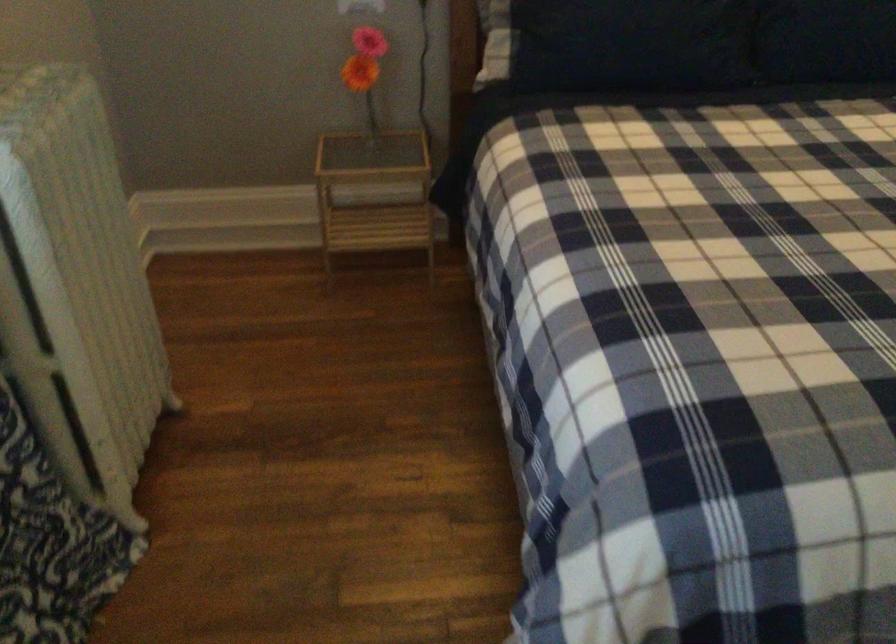
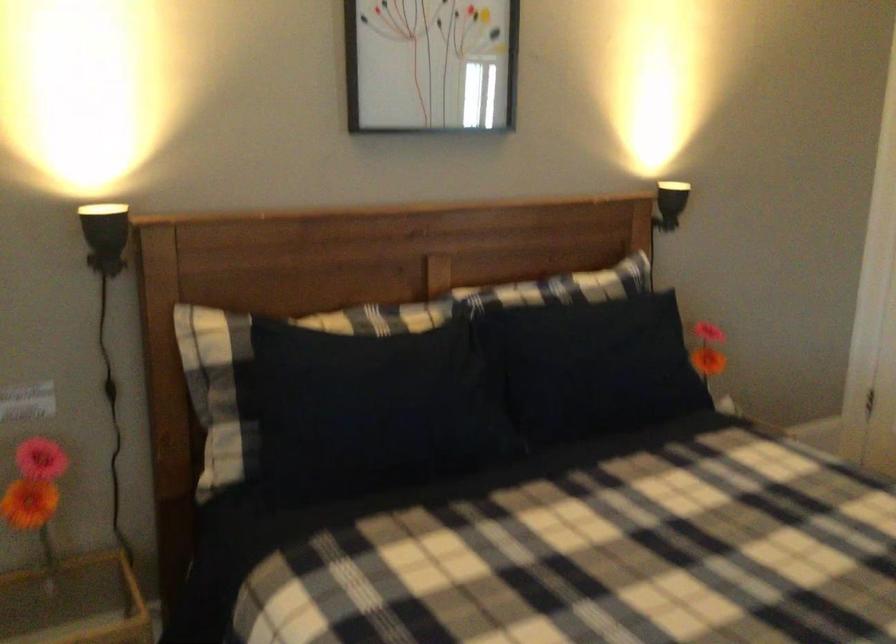
How did the camera likely rotate?

The rotation direction of the camera is right-up.